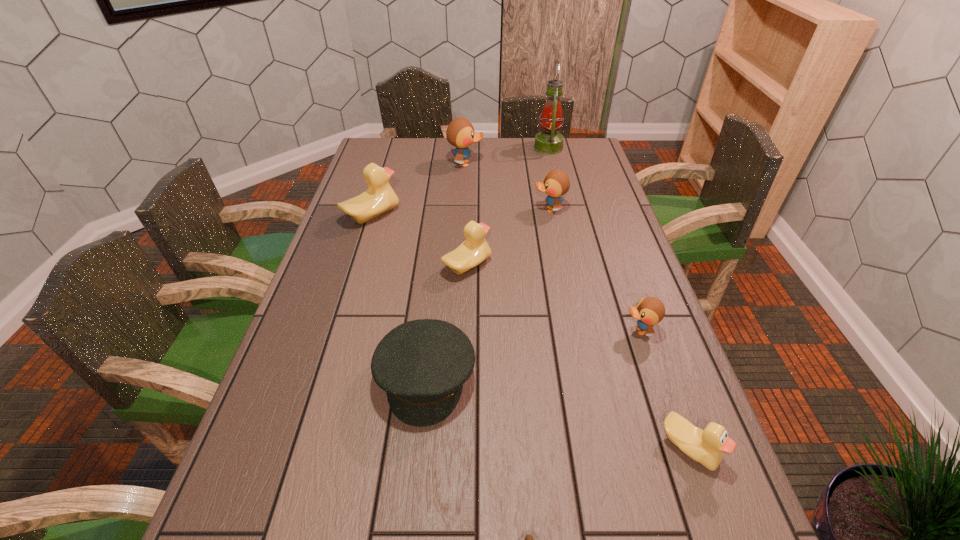
What are the coordinates of `oil lamp that is at the right edge` in the screenshot? It's located at (548, 142).

This screenshot has width=960, height=540. In order to click on object that is positioned at the far right corner in this screenshot , I will do `click(548, 142)`.

The height and width of the screenshot is (540, 960). I want to click on vacant area at the far edge of the desktop, so click(490, 153).

The width and height of the screenshot is (960, 540). I want to click on vacant space at the left edge of the desktop, so click(341, 235).

The image size is (960, 540). I want to click on free space at the right edge of the desktop, so click(x=732, y=526).

Locate an element on the screen. The height and width of the screenshot is (540, 960). free space at the far left corner of the desktop is located at coordinates (378, 151).

Locate an element on the screen. free space at the far right corner of the desktop is located at coordinates (579, 137).

Find the location of a particular element. Image resolution: width=960 pixels, height=540 pixels. vacant space that's between the smallest blue duck and the second beige duck from left to right is located at coordinates (x=553, y=298).

Where is `empty space that is in between the tallest object and the leftmost duck`? The height and width of the screenshot is (540, 960). empty space that is in between the tallest object and the leftmost duck is located at coordinates (460, 181).

Image resolution: width=960 pixels, height=540 pixels. Find the location of `empty space between the green oil lamp and the farthest duck`. empty space between the green oil lamp and the farthest duck is located at coordinates (507, 156).